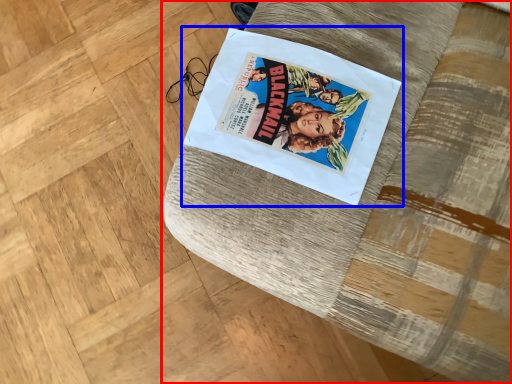
Question: Among these objects, which one is nearest to the camera, furniture (highlighted by a red box) or paperback book (highlighted by a blue box)?

Choices:
 (A) furniture
 (B) paperback book

Answer: (A)